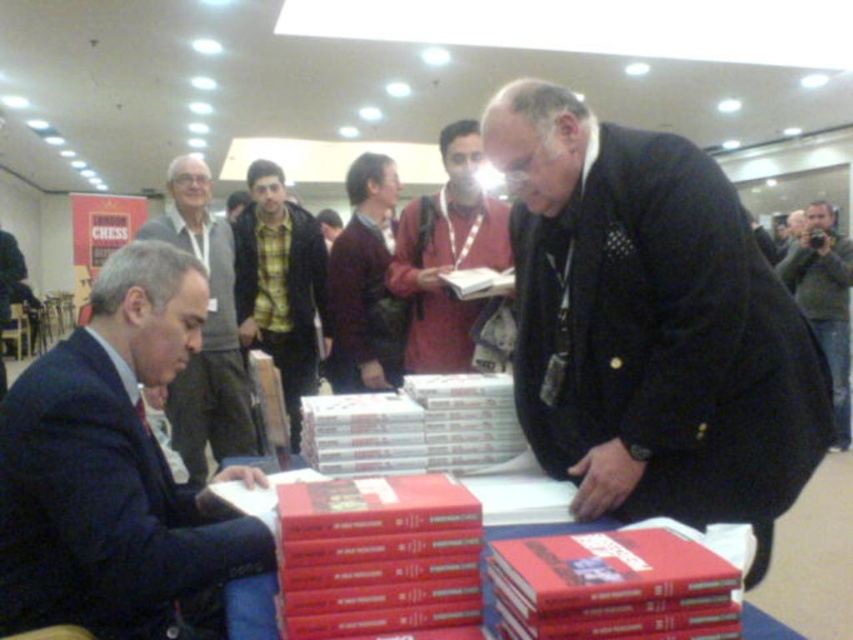
Question: Which object is farther from the camera taking this photo?

Choices:
 (A) yellow-green shirt at center
 (B) dark blue suit at left
 (C) matte black suit at left
 (D) green textured sweater at upper right

Answer: (D)

Question: Which point is closer to the camera taking this photo?

Choices:
 (A) tap(206, 218)
 (B) tap(364, 248)
 (C) tap(425, 198)

Answer: (C)

Question: Can you confirm if matte black suit at left is bigger than maroon sweater at center?

Choices:
 (A) yes
 (B) no

Answer: (A)

Question: Observing the image, what is the correct spatial positioning of matte black suit at left in reference to green textured sweater at upper right?

Choices:
 (A) right
 (B) left

Answer: (B)

Question: Estimate the real-world distances between objects in this image. Which object is farther from the matte red jacket at center?

Choices:
 (A) maroon sweater at center
 (B) yellow-green shirt at center
 (C) black fabric coat at center
 (D) dark blue suit at left

Answer: (D)

Question: Is yellow-green shirt at center thinner than matte black suit at left?

Choices:
 (A) yes
 (B) no

Answer: (B)